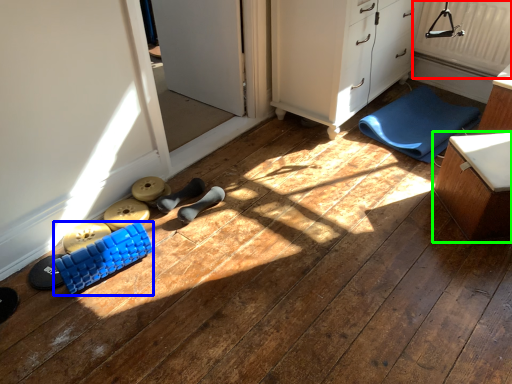
Question: Which object is positioned farthest from radiator (highlighted by a red box)? Select from toy (highlighted by a blue box) and furniture (highlighted by a green box).

Choices:
 (A) toy
 (B) furniture

Answer: (A)